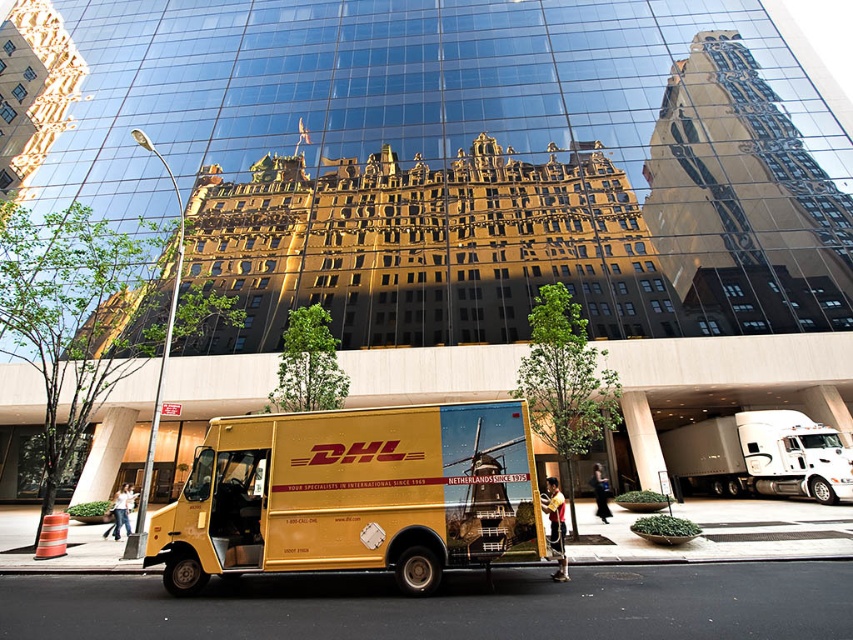
You are a delivery person who needs to park your metallic yellow delivery truck at center in a specific spot. The parking spot is marked at coordinates point A. If the truck is currently at point B, which is at coordinates point B, which direction should you move the truck to reach the parking spot?

The metallic yellow delivery truck at center is located at point B, so you need to move it towards point A to reach the parking spot.